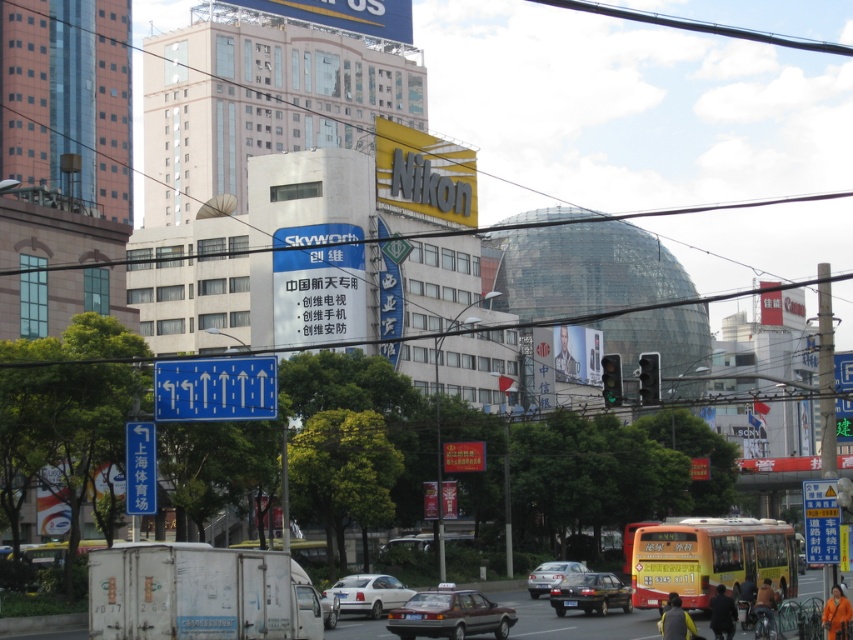
The image size is (853, 640). Identify the location of blue glossy sign at upper left. (215, 388).

Which is behind, point (151, 456) or point (550, 602)?

Positioned behind is point (550, 602).

Is white plastic sign at lower left below shiny black sedan at center?

No, white plastic sign at lower left is not below shiny black sedan at center.

Does point (142, 488) come behind point (602, 602)?

No, (142, 488) is closer to viewer.

The image size is (853, 640). I want to click on white plastic sign at lower left, so click(140, 468).

Is blue glossy sign at upper left wider than metallic pole at right?

Incorrect, blue glossy sign at upper left's width does not surpass metallic pole at right's.

Is blue glossy sign at upper left taller than metallic pole at right?

In fact, blue glossy sign at upper left may be shorter than metallic pole at right.

Locate an element on the screen. The width and height of the screenshot is (853, 640). blue glossy sign at upper left is located at coordinates (215, 388).